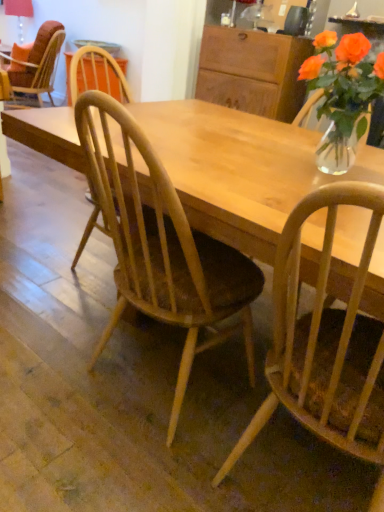
Question: From a real-world perspective, is translucent glass vase at upper right under light wood chair at center, the 2th chair from the top?

Choices:
 (A) yes
 (B) no

Answer: (B)

Question: Considering the relative sizes of translucent glass vase at upper right and light wood chair at center, acting as the second chair starting from the back, in the image provided, is translucent glass vase at upper right shorter than light wood chair at center, acting as the second chair starting from the back,?

Choices:
 (A) yes
 (B) no

Answer: (A)

Question: Can you confirm if translucent glass vase at upper right is positioned to the left of light wood chair at center, which is the 2th chair from bottom to top?

Choices:
 (A) yes
 (B) no

Answer: (B)

Question: Is translucent glass vase at upper right not near light wood chair at center, arranged as the 2th chair when viewed from the right?

Choices:
 (A) yes
 (B) no

Answer: (B)

Question: Is translucent glass vase at upper right closer to the viewer compared to light wood chair at center, which is the 2th chair in front-to-back order?

Choices:
 (A) no
 (B) yes

Answer: (A)

Question: Looking at their shapes, would you say translucent glass vase at upper right is wider or thinner than wooden cabinet at upper center?

Choices:
 (A) wide
 (B) thin

Answer: (B)

Question: Based on their positions, is translucent glass vase at upper right located to the left or right of wooden cabinet at upper center?

Choices:
 (A) right
 (B) left

Answer: (B)

Question: From the image's perspective, is translucent glass vase at upper right located above or below wooden cabinet at upper center?

Choices:
 (A) below
 (B) above

Answer: (A)

Question: From a real-world perspective, is translucent glass vase at upper right above or below wooden cabinet at upper center?

Choices:
 (A) above
 (B) below

Answer: (A)

Question: Is translucent glass vase at upper right taller or shorter than matte orange fabric chair at upper left, the 1th chair from the left?

Choices:
 (A) tall
 (B) short

Answer: (B)

Question: Is translucent glass vase at upper right bigger or smaller than matte orange fabric chair at upper left, positioned as the third chair in right-to-left order?

Choices:
 (A) small
 (B) big

Answer: (A)

Question: In terms of width, does translucent glass vase at upper right look wider or thinner when compared to matte orange fabric chair at upper left, positioned as the third chair in right-to-left order?

Choices:
 (A) wide
 (B) thin

Answer: (B)

Question: Do you think translucent glass vase at upper right is within matte orange fabric chair at upper left, which ranks as the 3th chair in front-to-back order, or outside of it?

Choices:
 (A) inside
 (B) outside

Answer: (B)

Question: Looking at the image, does wooden cabinet at upper center seem bigger or smaller compared to matte orange fabric chair at upper left, positioned as the third chair in right-to-left order?

Choices:
 (A) small
 (B) big

Answer: (A)

Question: Is point (274, 97) closer or farther from the camera than point (54, 50)?

Choices:
 (A) closer
 (B) farther

Answer: (A)